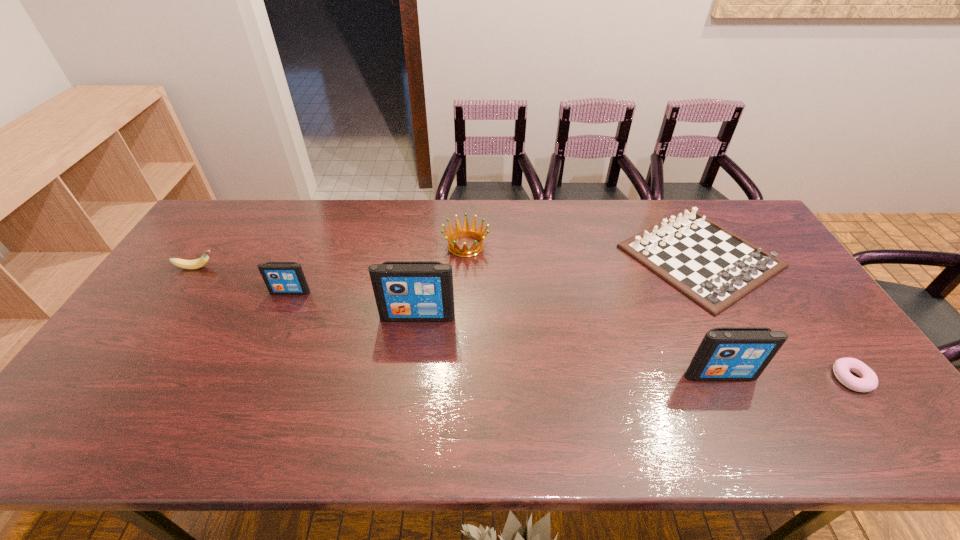
This screenshot has width=960, height=540. I want to click on free space between the shortest object and the crown, so click(x=659, y=312).

Find the location of a particular element. Image resolution: width=960 pixels, height=540 pixels. vacant space in between the nearest iPod and the second iPod from right to left is located at coordinates (568, 346).

Find the location of a particular element. free area in between the chessboard and the second tallest iPod is located at coordinates (709, 316).

Find the location of a particular element. vacant space in between the banana and the shortest object is located at coordinates point(524,323).

You are a GUI agent. You are given a task and a screenshot of the screen. Output one action in this format:
    pyautogui.click(x=<x>, y=<y>)
    Task: Click on the free point between the leftmost iPod and the second farthest iPod
    
    Given the screenshot: What is the action you would take?
    coord(354,304)

At what (x,y) coordinates should I click in order to perform the action: click on free space between the shortest iPod and the shortest object. Please return your answer as a coordinate pair (x, y). This screenshot has height=540, width=960. Looking at the image, I should click on (571, 335).

The width and height of the screenshot is (960, 540). In order to click on the third closest object to the crown in this screenshot , I will do `click(712, 266)`.

Image resolution: width=960 pixels, height=540 pixels. I want to click on object identified as the fifth closest to the second tallest iPod, so click(281, 278).

Point out which iPod is positioned as the third nearest to the crown. Please provide its 2D coordinates. Your answer should be formatted as a tuple, i.e. [(x, y)], where the tuple contains the x and y coordinates of a point satisfying the conditions above.

[(726, 353)]

Identify the location of iPod that is the second closest to the crown. The image size is (960, 540). (281, 278).